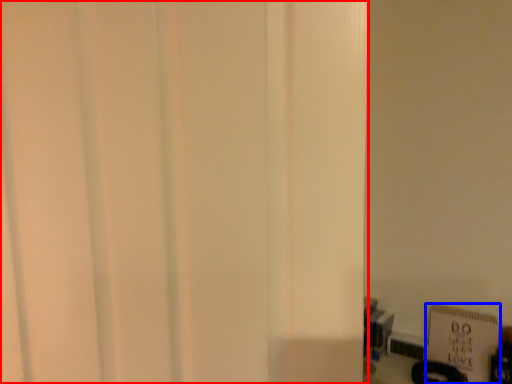
Question: Which object is closer to the camera taking this photo, door (highlighted by a red box) or bulletin board (highlighted by a blue box)?

Choices:
 (A) door
 (B) bulletin board

Answer: (A)